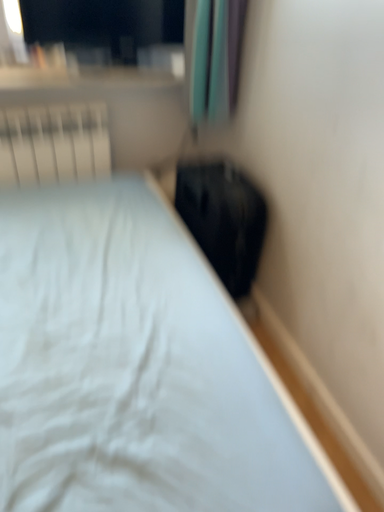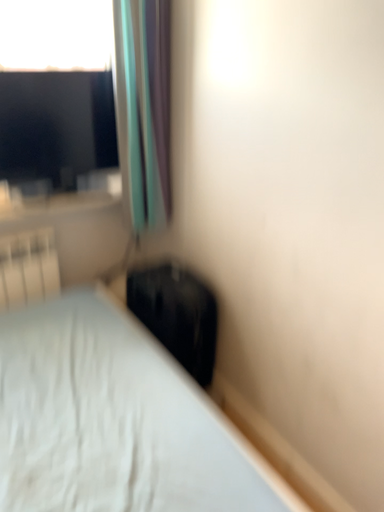
Question: How did the camera likely rotate when shooting the video?

Choices:
 (A) rotated downward
 (B) rotated upward

Answer: (B)